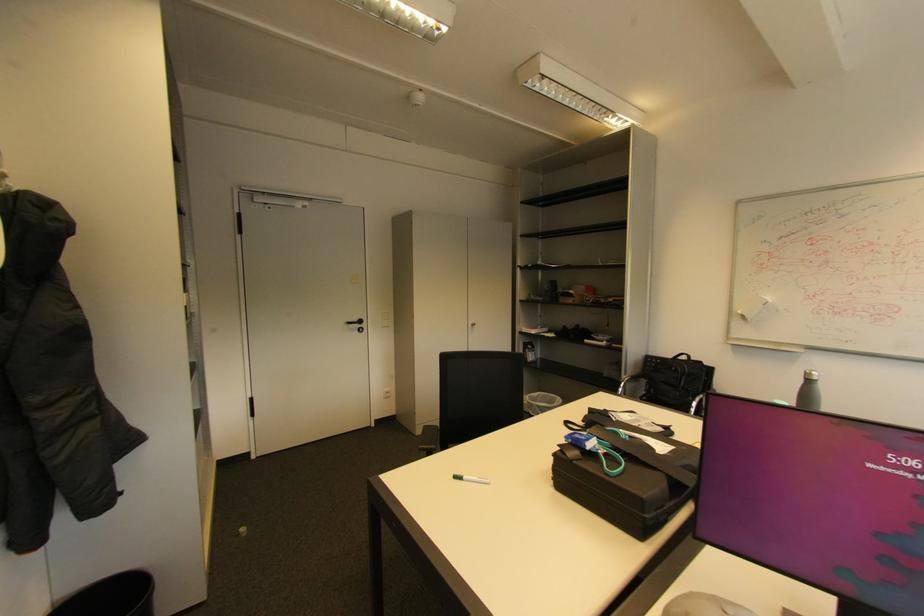
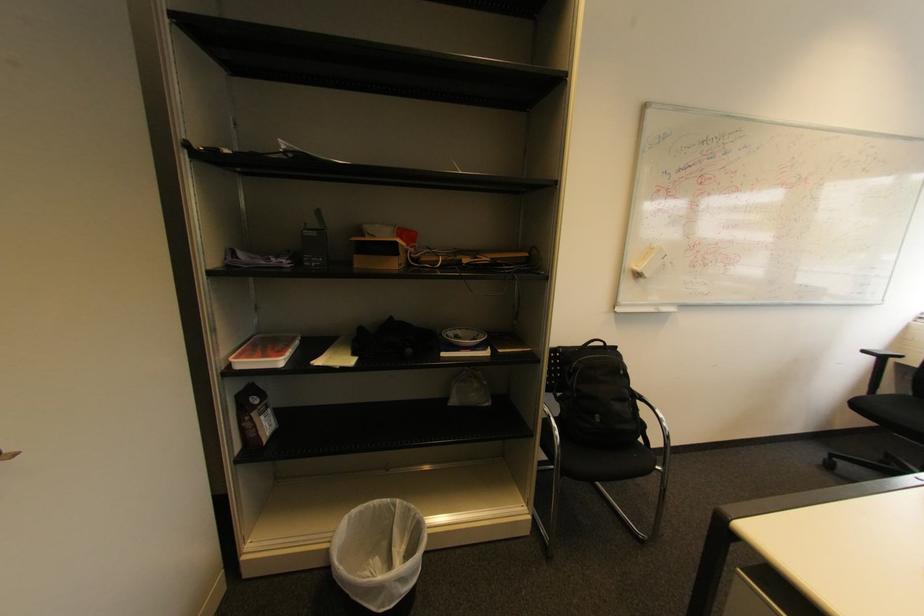
In the second image, find the point that corresponds to point (748, 318) in the first image.

(643, 276)